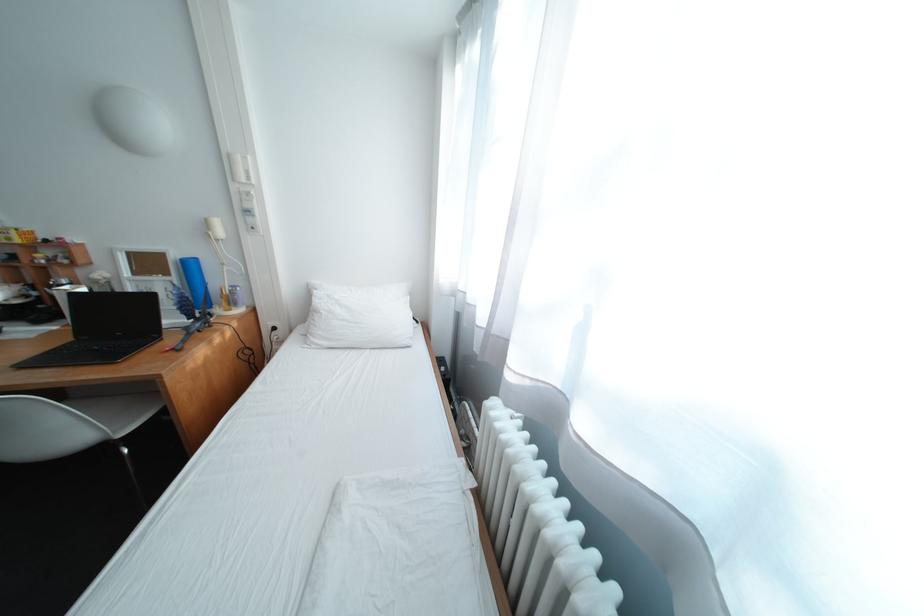
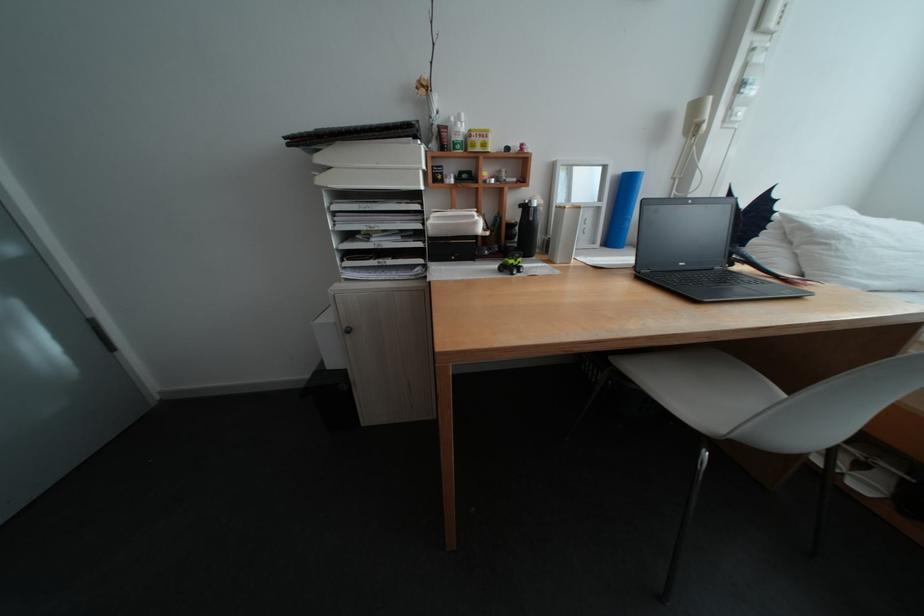
In the second image, find the point that corresponds to (x=187, y=280) in the first image.

(616, 205)